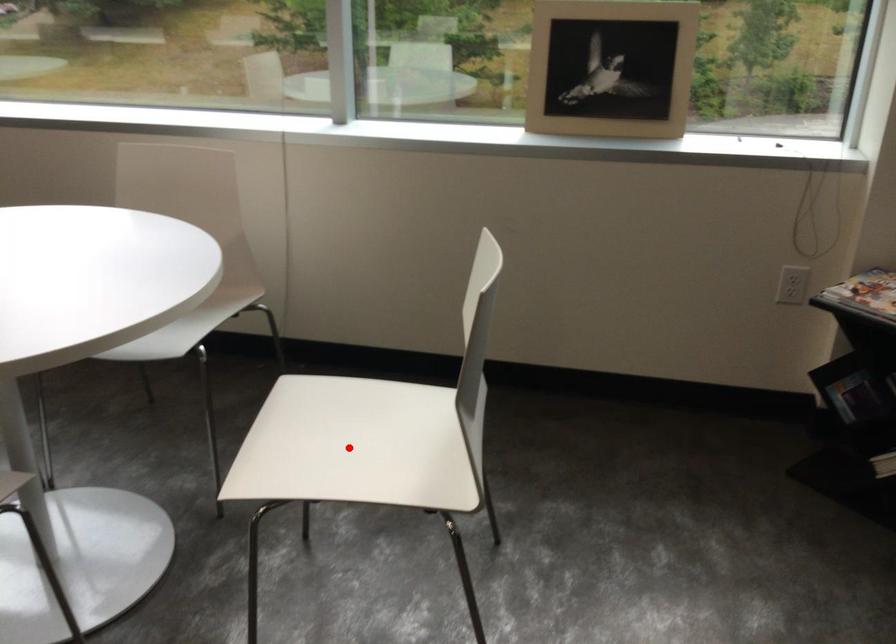
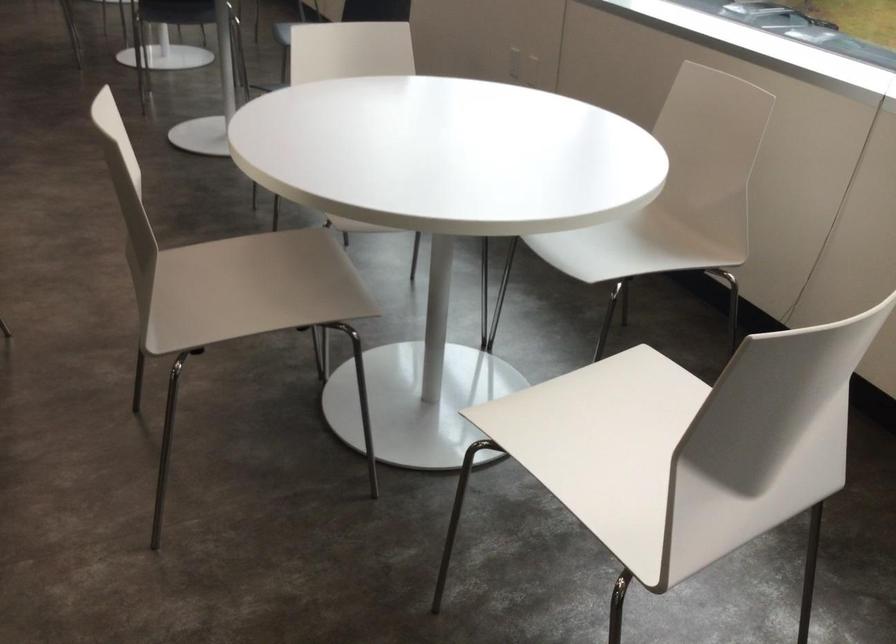
The point at the highlighted location is marked in the first image. Where is the corresponding point in the second image?

(604, 444)